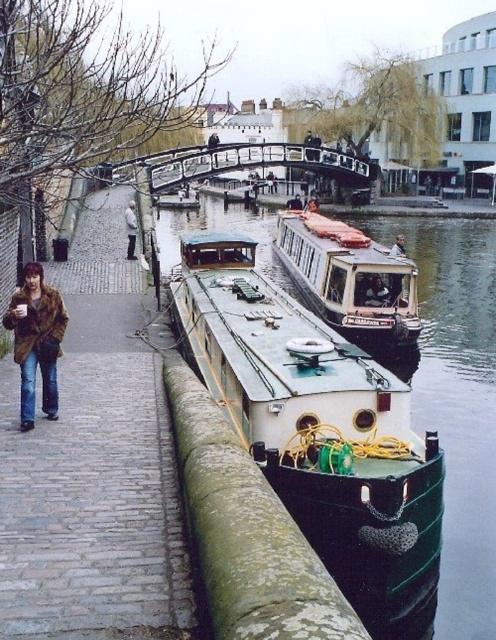
You are a fashion designer observing the canal scene. You need to recommend which coat to wear for a photoshoot that requires a more voluminous look. Which one would you choose between the brown fur coat at left and the matte black jacket at center?

The brown fur coat at left has a larger size compared to matte black jacket at center, so it would be the better choice for a more voluminous look in the photoshoot.

You are a tourist standing on the cobblestone path and want to take a photo of the white glossy houseboat at center and the light brown fur coat at left. Which object should you frame first in your camera to ensure both are in the shot?

The light brown fur coat at left should be framed first because the white glossy houseboat at center is positioned on the right side of it, meaning the houseboat is further to the right and the coat is closer to the left. By starting with the coat on the left, you can adjust your frame to include the houseboat to its right.

You are standing on the cobblestone path and want to walk to a specific location. You have two points to choose from in the scene. Which point, point 1 at coordinates point (53, 323) or point 2 at coordinates point (379, 300), is closer to you?

Point 1 at coordinates point (53, 323) is closer to you than point 2 at coordinates point (379, 300) because the description states that point (53, 323) is closer to the viewer than point (379, 300).